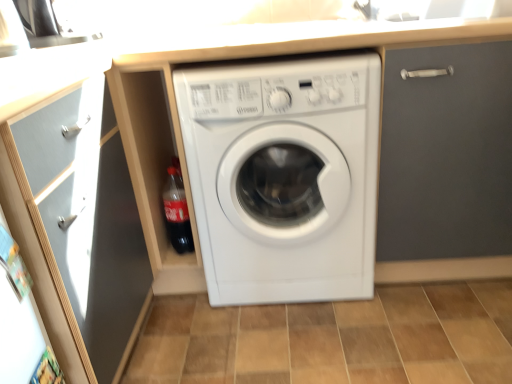
This screenshot has height=384, width=512. What do you see at coordinates (85, 217) in the screenshot?
I see `transparent glass door at left` at bounding box center [85, 217].

This screenshot has height=384, width=512. What are the coordinates of `translucent plastic bottle at lower left` in the screenshot? It's located at (177, 213).

This screenshot has width=512, height=384. What do you see at coordinates (333, 339) in the screenshot? I see `brown tile at center` at bounding box center [333, 339].

At what (x,y) coordinates should I click in order to perform the action: click on white plastic washing machine at center. Please return your answer as a coordinate pair (x, y). The image size is (512, 384). Looking at the image, I should click on (284, 176).

In order to face white plastic washing machine at center, should I rotate leftwards or rightwards?

Turn right by 3.498 degrees to look at white plastic washing machine at center.

The width and height of the screenshot is (512, 384). I want to click on matte gray door at upper right, so click(x=446, y=165).

Is translucent plastic bottle at lower left not close to matte gray door at upper right?

That's not correct — translucent plastic bottle at lower left is a little close to matte gray door at upper right.

Could you tell me if translucent plastic bottle at lower left is facing matte gray door at upper right?

No, translucent plastic bottle at lower left is not turned towards matte gray door at upper right.

Does translucent plastic bottle at lower left lie behind matte gray door at upper right?

Yes, it is behind matte gray door at upper right.

Which is less distant, (187,228) or (412,63)?

The point (412,63) is more forward.

Is white plastic washing machine at center behind transparent glass door at left?

Yes, it is.

Where is `washing machine above the transparent glass door at left (from a real-world perspective)`? washing machine above the transparent glass door at left (from a real-world perspective) is located at coordinates (284, 176).

Does white plastic washing machine at center have a greater width compared to transparent glass door at left?

Yes, white plastic washing machine at center is wider than transparent glass door at left.

Considering the relative sizes of white plastic washing machine at center and brown tile at center in the image provided, is white plastic washing machine at center shorter than brown tile at center?

In fact, white plastic washing machine at center may be taller than brown tile at center.

Considering the relative sizes of white plastic washing machine at center and brown tile at center in the image provided, is white plastic washing machine at center wider than brown tile at center?

Yes, white plastic washing machine at center is wider than brown tile at center.

Which object is positioned more to the right, white plastic washing machine at center or brown tile at center?

Positioned to the right is brown tile at center.

Is translucent plastic bottle at lower left next to brown tile at center?

No, translucent plastic bottle at lower left is not making contact with brown tile at center.

Considering the sizes of objects translucent plastic bottle at lower left and brown tile at center in the image provided, who is shorter, translucent plastic bottle at lower left or brown tile at center?

With less height is brown tile at center.

Does translucent plastic bottle at lower left have a lesser width compared to brown tile at center?

Yes, translucent plastic bottle at lower left is thinner than brown tile at center.

Is brown tile at center located within translucent plastic bottle at lower left?

No, brown tile at center is located outside of translucent plastic bottle at lower left.

Is the depth of brown tile at center greater than that of matte gray door at upper right?

Yes, the depth of brown tile at center is greater than that of matte gray door at upper right.

How different are the orientations of brown tile at center and matte gray door at upper right in degrees?

0.534 degrees separate the facing orientations of brown tile at center and matte gray door at upper right.

Between brown tile at center and matte gray door at upper right, which one has smaller width?

Result: Thinner between the two is brown tile at center.

Can you confirm if brown tile at center is positioned to the right of matte gray door at upper right?

No, brown tile at center is not to the right of matte gray door at upper right.

How many degrees apart are the facing directions of brown tile at center and translucent plastic bottle at lower left?

There is a 0.534-degree angle between the facing directions of brown tile at center and translucent plastic bottle at lower left.

Does brown tile at center come behind translucent plastic bottle at lower left?

No, it is in front of translucent plastic bottle at lower left.

From the image's perspective, is brown tile at center under translucent plastic bottle at lower left?

Yes, from the image's perspective, brown tile at center is below translucent plastic bottle at lower left.

Is transparent glass door at left taller than matte gray door at upper right?

Incorrect, the height of transparent glass door at left is not larger of that of matte gray door at upper right.

In the scene shown: Does transparent glass door at left appear on the left side of matte gray door at upper right?

Indeed, transparent glass door at left is positioned on the left side of matte gray door at upper right.

Is transparent glass door at left bigger or smaller than matte gray door at upper right?

In the image, transparent glass door at left appears to be larger than matte gray door at upper right.

Find the location of `door on the right of the translucent plastic bottle at lower left`. door on the right of the translucent plastic bottle at lower left is located at coordinates (446, 165).

The width and height of the screenshot is (512, 384). I want to click on glass door below the white plastic washing machine at center (from a real-world perspective), so click(x=85, y=217).

Considering their positions, is translucent plastic bottle at lower left positioned further to brown tile at center than white plastic washing machine at center?

translucent plastic bottle at lower left is positioned further to the anchor brown tile at center.

Which object lies further to the anchor point white plastic washing machine at center, brown tile at center or matte gray door at upper right?

brown tile at center is further to white plastic washing machine at center.

Looking at the image, which one is located further to matte gray door at upper right, white plastic washing machine at center or brown tile at center?

The object further to matte gray door at upper right is brown tile at center.

Estimate the real-world distances between objects in this image. Which object is further from transparent glass door at left, translucent plastic bottle at lower left or white plastic washing machine at center?

white plastic washing machine at center is positioned further to the anchor transparent glass door at left.

Which object lies further to the anchor point white plastic washing machine at center, matte gray door at upper right or translucent plastic bottle at lower left?

translucent plastic bottle at lower left lies further to white plastic washing machine at center than the other object.

In the scene shown: Considering their positions, is matte gray door at upper right positioned closer to translucent plastic bottle at lower left than transparent glass door at left?

transparent glass door at left.

From the image, which object appears to be nearer to transparent glass door at left, white plastic washing machine at center or translucent plastic bottle at lower left?

translucent plastic bottle at lower left.

From the image, which object appears to be nearer to transparent glass door at left, translucent plastic bottle at lower left or brown tile at center?

translucent plastic bottle at lower left lies closer to transparent glass door at left than the other object.

You are a GUI agent. You are given a task and a screenshot of the screen. Output one action in this format:
    pyautogui.click(x=<x>, y=<y>)
    Task: Click on the washing machine between matte gray door at upper right and brown tile at center vertically
    
    Given the screenshot: What is the action you would take?
    pyautogui.click(x=284, y=176)

Identify the location of bottle located between transparent glass door at left and brown tile at center in the left-right direction. (177, 213).

Where is `tile between translucent plastic bottle at lower left and matte gray door at upper right`? tile between translucent plastic bottle at lower left and matte gray door at upper right is located at coordinates (333, 339).

Find the location of a particular element. bottle between transparent glass door at left and white plastic washing machine at center is located at coordinates (177, 213).